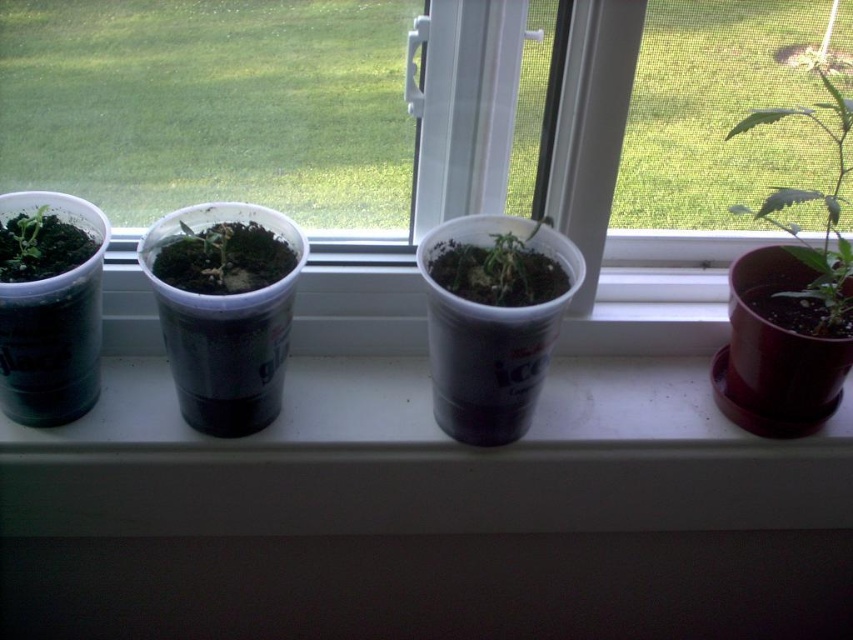
Is transparent plastic cups at center positioned behind green matte plastic cup at left?

That is True.

Is point (633, 228) farther from viewer compared to point (36, 211)?

Yes, it is.

Image resolution: width=853 pixels, height=640 pixels. What are the coordinates of `transparent plastic cups at center` in the screenshot? It's located at (267, 134).

Can you confirm if green matte plant at right is wider than green matte plastic cup at center?

Yes.

Which is more to the right, green matte plant at right or green matte plastic cup at center?

green matte plant at right

Image resolution: width=853 pixels, height=640 pixels. Describe the element at coordinates (811, 200) in the screenshot. I see `green matte plant at right` at that location.

Identify the location of green matte plant at right. (811, 200).

Measure the distance from white plastic cups at center to green matte plastic cup at left.

18.52 inches

Which is in front, point (456, 513) or point (9, 266)?

Point (9, 266) is more forward.

Locate an element on the screen. white plastic cups at center is located at coordinates (421, 460).